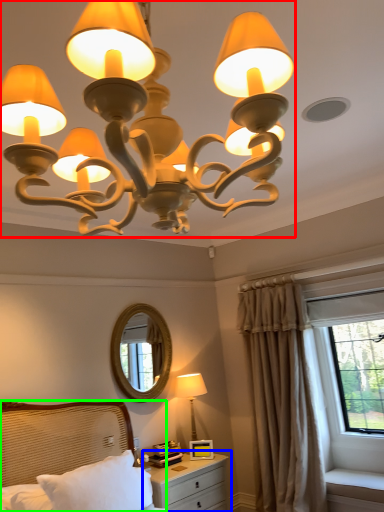
Question: Which is farther away from lamp (highlighted by a red box)? nightstand (highlighted by a blue box) or bed (highlighted by a green box)?

Choices:
 (A) nightstand
 (B) bed

Answer: (A)